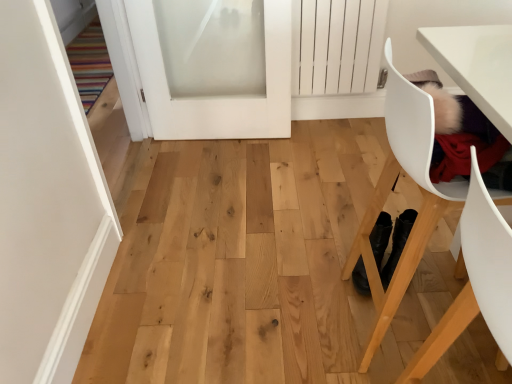
Identify the location of white matte door at upper left, the first door positioned from the left. This screenshot has height=384, width=512. (47, 203).

The width and height of the screenshot is (512, 384). What are the coordinates of `white plastic chair at lower right, the 1th chair viewed from the front` in the screenshot? It's located at pyautogui.click(x=475, y=282).

Considering the relative sizes of white plastic chair at right, marked as the 2th chair in a front-to-back arrangement, and white plastic chair at lower right, the 1th chair viewed from the front, in the image provided, is white plastic chair at right, marked as the 2th chair in a front-to-back arrangement, smaller than white plastic chair at lower right, the 1th chair viewed from the front,?

No.

Locate an element on the screen. chair in front of the white plastic chair at right, the 1th chair positioned from the back is located at coordinates (475, 282).

Would you say white plastic chair at right, marked as the 2th chair in a front-to-back arrangement, is inside or outside white plastic chair at lower right, the 1th chair viewed from the front?

white plastic chair at right, marked as the 2th chair in a front-to-back arrangement, is not enclosed by white plastic chair at lower right, the 1th chair viewed from the front.

Is white plastic chair at right, marked as the 2th chair in a front-to-back arrangement, positioned in front of white plastic chair at lower right, the 1th chair viewed from the front?

No, it is not.

From a real-world perspective, is white matte door at upper left, the first door positioned from the left, on top of white plastic chair at right, the 1th chair positioned from the back?

Correct, in the physical world, white matte door at upper left, the first door positioned from the left, is higher than white plastic chair at right, the 1th chair positioned from the back.

Consider the image. Would you say white matte door at upper left, the 2th door from the right, is to the left or to the right of white plastic chair at right, the 1th chair positioned from the back, in the picture?

Clearly, white matte door at upper left, the 2th door from the right, is on the left of white plastic chair at right, the 1th chair positioned from the back, in the image.

Is white matte door at upper left, the 2th door from the right, shorter than white plastic chair at right, marked as the 2th chair in a front-to-back arrangement?

No.

Is point (70, 197) positioned before point (409, 239)?

No, it is behind (409, 239).

Is white plastic chair at lower right, the second chair in the back-to-front sequence, with white frosted glass door at upper center, acting as the first door starting from the right?

white plastic chair at lower right, the second chair in the back-to-front sequence, and white frosted glass door at upper center, acting as the first door starting from the right, are clearly separated.

Is white plastic chair at lower right, the second chair in the back-to-front sequence, oriented away from white frosted glass door at upper center, acting as the first door starting from the right?

No, white plastic chair at lower right, the second chair in the back-to-front sequence, is not facing the opposite direction of white frosted glass door at upper center, acting as the first door starting from the right.

Between white plastic chair at lower right, the second chair in the back-to-front sequence, and white frosted glass door at upper center, the second door positioned from the left, which one appears on the left side from the viewer's perspective?

Positioned to the left is white frosted glass door at upper center, the second door positioned from the left.

Considering the sizes of objects white matte door at upper left, the 2th door from the right, and white plastic chair at lower right, the 1th chair viewed from the front, in the image provided, who is bigger, white matte door at upper left, the 2th door from the right, or white plastic chair at lower right, the 1th chair viewed from the front,?

white matte door at upper left, the 2th door from the right.

Which object is positioned more to the left, white matte door at upper left, the first door positioned from the left, or white plastic chair at lower right, the second chair in the back-to-front sequence?

white matte door at upper left, the first door positioned from the left.

Is white matte door at upper left, the first door positioned from the left, far from white plastic chair at lower right, the 1th chair viewed from the front?

white matte door at upper left, the first door positioned from the left, is far away from white plastic chair at lower right, the 1th chair viewed from the front.

Consider the image. Is white matte door at upper left, the first door positioned from the left, facing towards white plastic chair at lower right, the 1th chair viewed from the front?

No, white matte door at upper left, the first door positioned from the left, is not aimed at white plastic chair at lower right, the 1th chair viewed from the front.

Is point (50, 373) farther from viewer compared to point (136, 11)?

No, it is in front of (136, 11).

From the image's perspective, which one is positioned lower, white matte door at upper left, the 2th door from the right, or white frosted glass door at upper center, acting as the first door starting from the right?

white matte door at upper left, the 2th door from the right.

In the scene shown: Is white matte door at upper left, the 2th door from the right, looking in the opposite direction of white frosted glass door at upper center, the second door positioned from the left?

white matte door at upper left, the 2th door from the right, is not turned away from white frosted glass door at upper center, the second door positioned from the left.

Is white matte door at upper left, the 2th door from the right, placed right next to white frosted glass door at upper center, acting as the first door starting from the right?

white matte door at upper left, the 2th door from the right, is not next to white frosted glass door at upper center, acting as the first door starting from the right, and they're not touching.

Locate an element on the screen. Image resolution: width=512 pixels, height=384 pixels. door that is the 2nd object located above the white plastic chair at right, marked as the 2th chair in a front-to-back arrangement (from the image's perspective) is located at coordinates (216, 98).

How different are the orientations of white plastic chair at right, the 1th chair positioned from the back, and white frosted glass door at upper center, the second door positioned from the left, in degrees?

The angular difference between white plastic chair at right, the 1th chair positioned from the back, and white frosted glass door at upper center, the second door positioned from the left, is 90.5 degrees.

From the image's perspective, is white plastic chair at right, the 1th chair positioned from the back, positioned above or below white frosted glass door at upper center, acting as the first door starting from the right?

Clearly, from the image's perspective, white plastic chair at right, the 1th chair positioned from the back, is below white frosted glass door at upper center, acting as the first door starting from the right.

Is white plastic chair at right, the 1th chair positioned from the back, shorter than white frosted glass door at upper center, the second door positioned from the left?

In fact, white plastic chair at right, the 1th chair positioned from the back, may be taller than white frosted glass door at upper center, the second door positioned from the left.

Is white frosted glass door at upper center, acting as the first door starting from the right, at the right side of white matte door at upper left, the 2th door from the right?

Yes.

Is point (147, 59) farther from camera compared to point (69, 145)?

Yes, it is behind point (69, 145).

Which of these two, white frosted glass door at upper center, acting as the first door starting from the right, or white matte door at upper left, the 2th door from the right, stands shorter?

Standing shorter between the two is white frosted glass door at upper center, acting as the first door starting from the right.

Where is `door above the white frosted glass door at upper center, the second door positioned from the left (from a real-world perspective)`? This screenshot has height=384, width=512. door above the white frosted glass door at upper center, the second door positioned from the left (from a real-world perspective) is located at coordinates (47, 203).

This screenshot has width=512, height=384. In the image, there is a white plastic chair at lower right, the second chair in the back-to-front sequence. Identify the location of chair below it (from a real-world perspective). (389, 191).

There is a white plastic chair at right, the 1th chair positioned from the back. At what (x,y) coordinates should I click in order to perform the action: click on the 1st door above it (from the image's perspective). Please return your answer as a coordinate pair (x, y). Looking at the image, I should click on (47, 203).

Looking at the image, which one is located closer to white frosted glass door at upper center, acting as the first door starting from the right, white plastic chair at right, the 1th chair positioned from the back, or white plastic chair at lower right, the second chair in the back-to-front sequence?

white plastic chair at right, the 1th chair positioned from the back, is positioned closer to the anchor white frosted glass door at upper center, acting as the first door starting from the right.

Estimate the real-world distances between objects in this image. Which object is closer to white plastic chair at lower right, the second chair in the back-to-front sequence, white plastic chair at right, the 1th chair positioned from the back, or white frosted glass door at upper center, the second door positioned from the left?

The object closer to white plastic chair at lower right, the second chair in the back-to-front sequence, is white plastic chair at right, the 1th chair positioned from the back.

Considering their positions, is white matte door at upper left, the first door positioned from the left, positioned further to white plastic chair at lower right, the 1th chair viewed from the front, than white plastic chair at right, the 1th chair positioned from the back?

The object further to white plastic chair at lower right, the 1th chair viewed from the front, is white matte door at upper left, the first door positioned from the left.

From the image, which object appears to be farther from white plastic chair at right, marked as the 2th chair in a front-to-back arrangement, white plastic chair at lower right, the 1th chair viewed from the front, or white matte door at upper left, the first door positioned from the left?

The object further to white plastic chair at right, marked as the 2th chair in a front-to-back arrangement, is white matte door at upper left, the first door positioned from the left.

Based on their spatial positions, is white matte door at upper left, the first door positioned from the left, or white frosted glass door at upper center, the second door positioned from the left, closer to white plastic chair at lower right, the 1th chair viewed from the front?

white matte door at upper left, the first door positioned from the left, is positioned closer to the anchor white plastic chair at lower right, the 1th chair viewed from the front.

Consider the image. Based on their spatial positions, is white frosted glass door at upper center, the second door positioned from the left, or white plastic chair at right, marked as the 2th chair in a front-to-back arrangement, closer to white matte door at upper left, the 2th door from the right?

Based on the image, white plastic chair at right, marked as the 2th chair in a front-to-back arrangement, appears to be nearer to white matte door at upper left, the 2th door from the right.

Consider the image. Based on their spatial positions, is white plastic chair at right, marked as the 2th chair in a front-to-back arrangement, or white matte door at upper left, the first door positioned from the left, further from white plastic chair at lower right, the 1th chair viewed from the front?

white matte door at upper left, the first door positioned from the left, is further to white plastic chair at lower right, the 1th chair viewed from the front.

From the image, which object appears to be nearer to white matte door at upper left, the 2th door from the right, white plastic chair at lower right, the 1th chair viewed from the front, or white plastic chair at right, the 1th chair positioned from the back?

Based on the image, white plastic chair at right, the 1th chair positioned from the back, appears to be nearer to white matte door at upper left, the 2th door from the right.

Where is `door between white matte door at upper left, the 2th door from the right, and white plastic chair at right, the 1th chair positioned from the back, from left to right`? The width and height of the screenshot is (512, 384). door between white matte door at upper left, the 2th door from the right, and white plastic chair at right, the 1th chair positioned from the back, from left to right is located at coordinates (216, 98).

Identify the location of chair between white plastic chair at lower right, the second chair in the back-to-front sequence, and white frosted glass door at upper center, the second door positioned from the left, along the z-axis. The width and height of the screenshot is (512, 384). point(389,191).

You are a GUI agent. You are given a task and a screenshot of the screen. Output one action in this format:
    pyautogui.click(x=<x>, y=<y>)
    Task: Click on the chair between white matte door at upper left, the first door positioned from the left, and white plastic chair at right, marked as the 2th chair in a front-to-back arrangement
    Image resolution: width=512 pixels, height=384 pixels.
    Given the screenshot: What is the action you would take?
    pyautogui.click(x=475, y=282)

Locate an element on the screen. The image size is (512, 384). door between white plastic chair at lower right, the second chair in the back-to-front sequence, and white frosted glass door at upper center, acting as the first door starting from the right, in the front-back direction is located at coordinates click(47, 203).